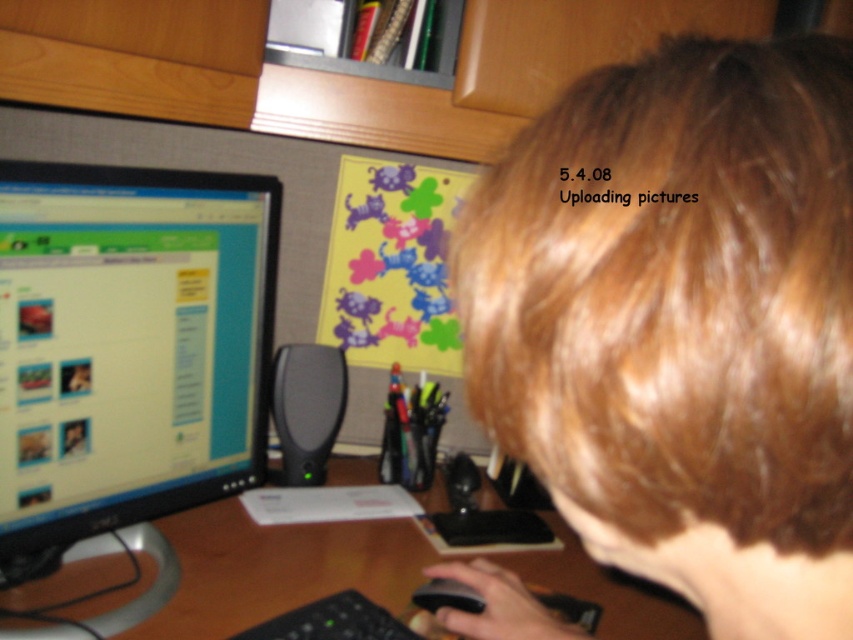
Can you confirm if black glossy monitor at left is wider than wooden at center?

Incorrect, black glossy monitor at left's width does not surpass wooden at center's.

The height and width of the screenshot is (640, 853). Describe the element at coordinates (128, 356) in the screenshot. I see `black glossy monitor at left` at that location.

Where is `black glossy monitor at left`? The height and width of the screenshot is (640, 853). black glossy monitor at left is located at coordinates (128, 356).

Does brown hair at upper right have a lesser width compared to black glossy monitor at left?

Correct, brown hair at upper right's width is less than black glossy monitor at left's.

In the scene shown: Who is more distant from viewer, (672,513) or (103,371)?

The point (103,371) is more distant.

The height and width of the screenshot is (640, 853). Describe the element at coordinates (682, 323) in the screenshot. I see `brown hair at upper right` at that location.

Locate an element on the screen. The image size is (853, 640). brown hair at upper right is located at coordinates (682, 323).

Does black plastic keyboard at lower center appear over black plastic mouse at lower center?

Actually, black plastic keyboard at lower center is below black plastic mouse at lower center.

Can you confirm if black plastic keyboard at lower center is positioned below black plastic mouse at lower center?

Correct, black plastic keyboard at lower center is located below black plastic mouse at lower center.

Locate an element on the screen. Image resolution: width=853 pixels, height=640 pixels. black plastic keyboard at lower center is located at coordinates (332, 621).